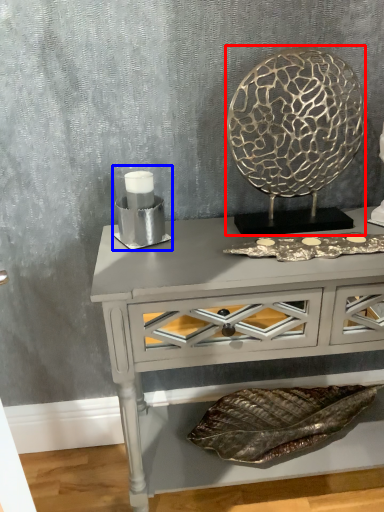
Question: Which point is closer to the camera, round table (highlighted by a red box) or candle holder (highlighted by a blue box)?

Choices:
 (A) round table
 (B) candle holder

Answer: (A)